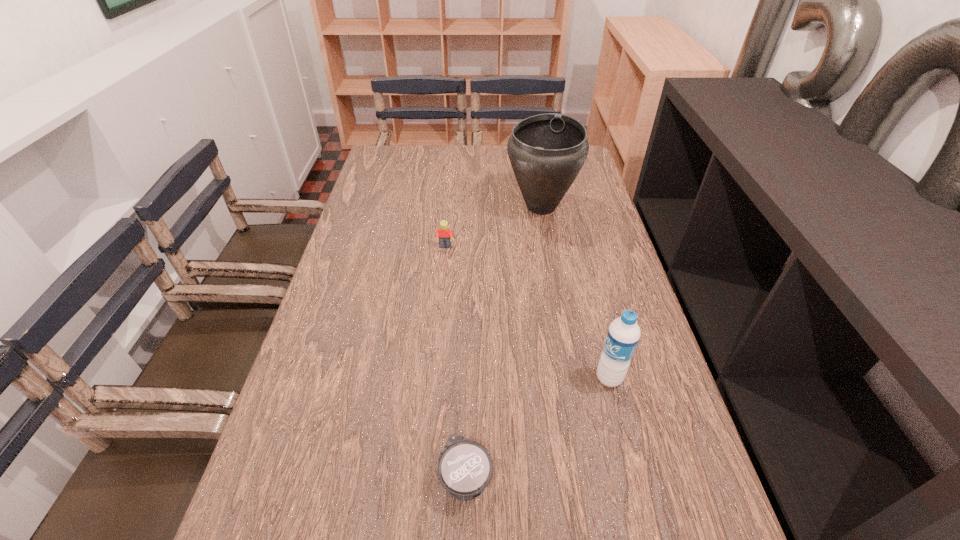
Image resolution: width=960 pixels, height=540 pixels. In order to click on vacant space located on the label of the water bottle in this screenshot , I will do `click(444, 378)`.

This screenshot has height=540, width=960. I want to click on vacant space situated 0.280m on the label of the water bottle, so click(x=468, y=378).

Identify the location of vacant space located 0.200m on the face of the Lego. Image resolution: width=960 pixels, height=540 pixels. (441, 300).

Locate an element on the screen. This screenshot has height=540, width=960. vacant space situated 0.160m on the back of the nearest object is located at coordinates (468, 378).

Locate an element on the screen. The image size is (960, 540). urn located at the right edge is located at coordinates (547, 151).

In order to click on water bottle situated at the right edge in this screenshot , I will do `click(623, 334)`.

This screenshot has width=960, height=540. In the image, there is a desktop. Find the location of `vacant region at the far edge`. vacant region at the far edge is located at coordinates (417, 164).

The width and height of the screenshot is (960, 540). In order to click on vacant area at the left edge in this screenshot , I will do `click(332, 288)`.

In the image, there is a desktop. Where is `vacant space at the right edge`? vacant space at the right edge is located at coordinates (652, 484).

Where is `vacant region between the nearest object and the third tallest object`? This screenshot has width=960, height=540. vacant region between the nearest object and the third tallest object is located at coordinates (456, 362).